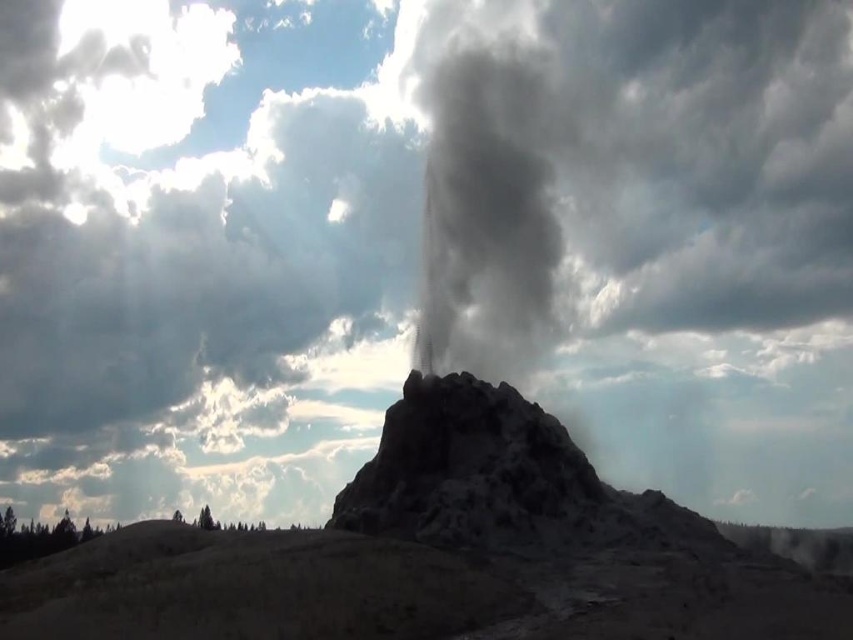
Question: Can you confirm if gray/cloudy smoke at center is positioned to the right of rough stone rock formation at center?

Choices:
 (A) yes
 (B) no

Answer: (A)

Question: Does gray/cloudy smoke at center have a greater width compared to rough stone rock formation at center?

Choices:
 (A) no
 (B) yes

Answer: (B)

Question: Is gray/cloudy smoke at center smaller than rough stone rock formation at center?

Choices:
 (A) yes
 (B) no

Answer: (B)

Question: Which object is farther from the camera taking this photo?

Choices:
 (A) gray/cloudy smoke at center
 (B) rough stone rock formation at center

Answer: (A)

Question: Which point appears farthest from the camera in this image?

Choices:
 (A) (459, 326)
 (B) (366, 468)

Answer: (A)

Question: Which of the following is the closest to the observer?

Choices:
 (A) (436, 451)
 (B) (463, 60)

Answer: (A)